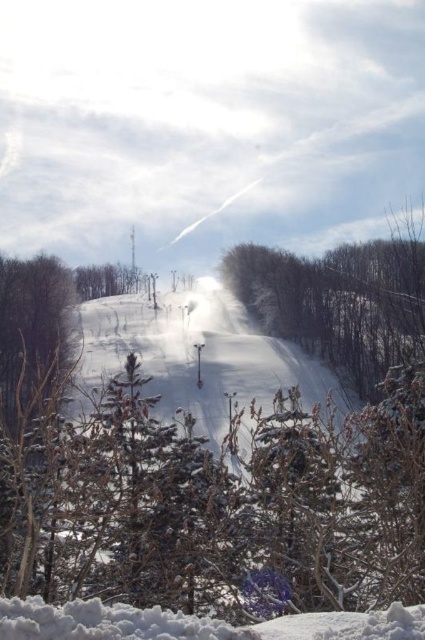
Question: Is the position of brown textured tree at left less distant than that of green matte tree at upper center?

Choices:
 (A) yes
 (B) no

Answer: (A)

Question: Is brown textured tree at left positioned behind green matte tree at upper center?

Choices:
 (A) yes
 (B) no

Answer: (B)

Question: Among these points, which one is nearest to the camera?

Choices:
 (A) (10, 412)
 (B) (81, 282)

Answer: (A)

Question: Where is brown textured tree at left located in relation to green matte tree at upper center in the image?

Choices:
 (A) above
 (B) below

Answer: (B)

Question: Which point is farther to the camera?

Choices:
 (A) green matte tree at upper center
 (B) brown textured tree at left

Answer: (A)